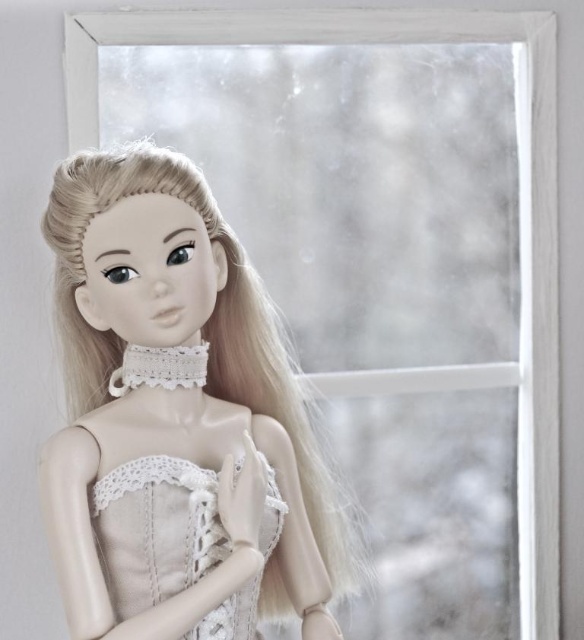
Based on the provided scene, where is the smooth porcelain doll at center located in terms of coordinates?

The smooth porcelain doll at center is located at point coordinates of [178,420].

You are a toy collector who wants to place a 3.5 inch tall action figure on a shelf next to the smooth porcelain doll at center and the satin lace dress at center. Can the action figure fit between them without overlapping?

The distance between the smooth porcelain doll at center and the satin lace dress at center is 3.40 inches. Since the action figure is 3.5 inches tall, it might not fit vertically between them as the space is slightly smaller than the figure.